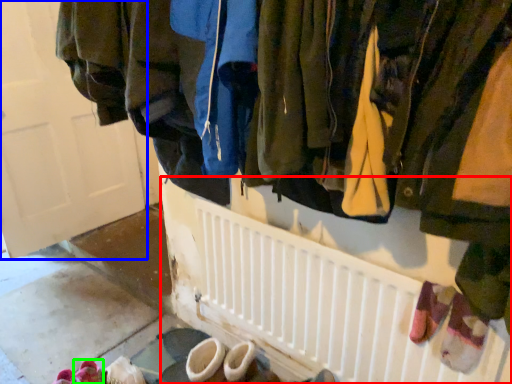
Question: Based on their relative distances, which object is farther from radiator (highlighted by a red box)? Choose from door (highlighted by a blue box) and footwear (highlighted by a green box).

Choices:
 (A) door
 (B) footwear

Answer: (A)